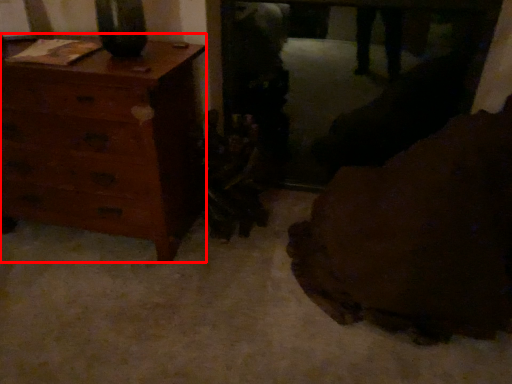
Question: From the image's perspective, where is chest of drawers (annotated by the red box) located in relation to furniture in the image?

Choices:
 (A) below
 (B) above

Answer: (B)